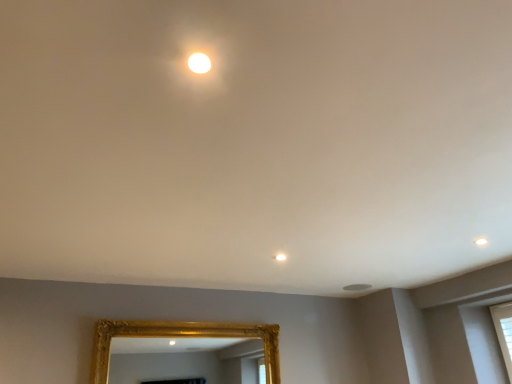
Question: Is gold textured mirror at lower center far from matte white light at upper center?

Choices:
 (A) no
 (B) yes

Answer: (B)

Question: From the image's perspective, is gold textured mirror at lower center over matte white light at upper center?

Choices:
 (A) yes
 (B) no

Answer: (B)

Question: Could you tell me if gold textured mirror at lower center is facing matte white light at upper center?

Choices:
 (A) yes
 (B) no

Answer: (A)

Question: Is gold textured mirror at lower center not inside matte white light at upper center?

Choices:
 (A) yes
 (B) no

Answer: (A)

Question: Does gold textured mirror at lower center come behind matte white light at upper center?

Choices:
 (A) no
 (B) yes

Answer: (B)

Question: From the image's perspective, would you say gold textured mirror at lower center is shown under matte white light at upper center?

Choices:
 (A) no
 (B) yes

Answer: (B)

Question: Can you confirm if matte white light at upper center is wider than gold textured mirror at lower center?

Choices:
 (A) yes
 (B) no

Answer: (B)

Question: Does matte white light at upper center have a lesser width compared to gold textured mirror at lower center?

Choices:
 (A) no
 (B) yes

Answer: (B)

Question: Is matte white light at upper center smaller than gold textured mirror at lower center?

Choices:
 (A) yes
 (B) no

Answer: (A)

Question: Does matte white light at upper center come behind gold textured mirror at lower center?

Choices:
 (A) yes
 (B) no

Answer: (B)

Question: Is matte white light at upper center surrounding gold textured mirror at lower center?

Choices:
 (A) no
 (B) yes

Answer: (A)

Question: Is matte white light at upper center in front of gold textured mirror at lower center?

Choices:
 (A) yes
 (B) no

Answer: (A)

Question: In the image, is gold textured mirror at lower center positioned in front of or behind matte white light at upper center?

Choices:
 (A) behind
 (B) front

Answer: (A)